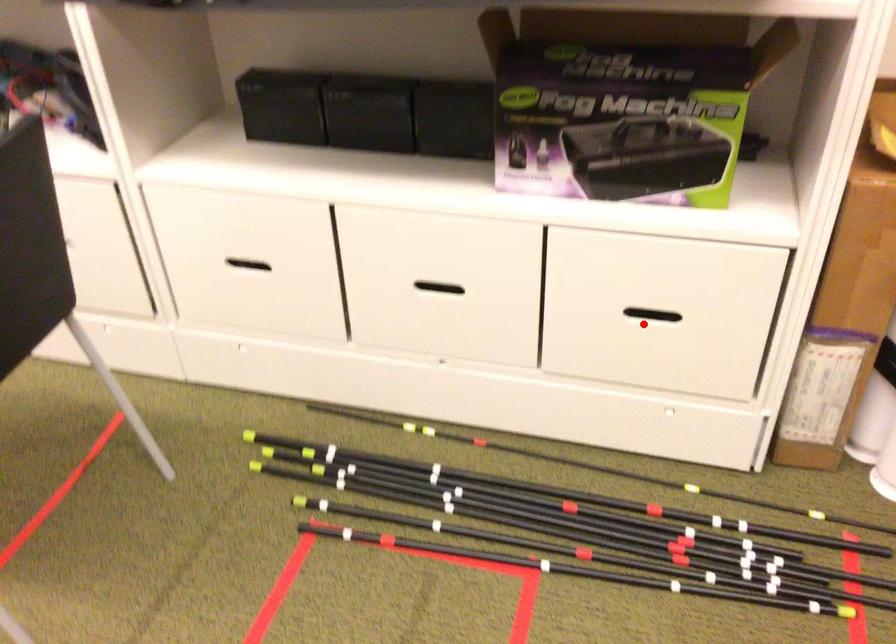
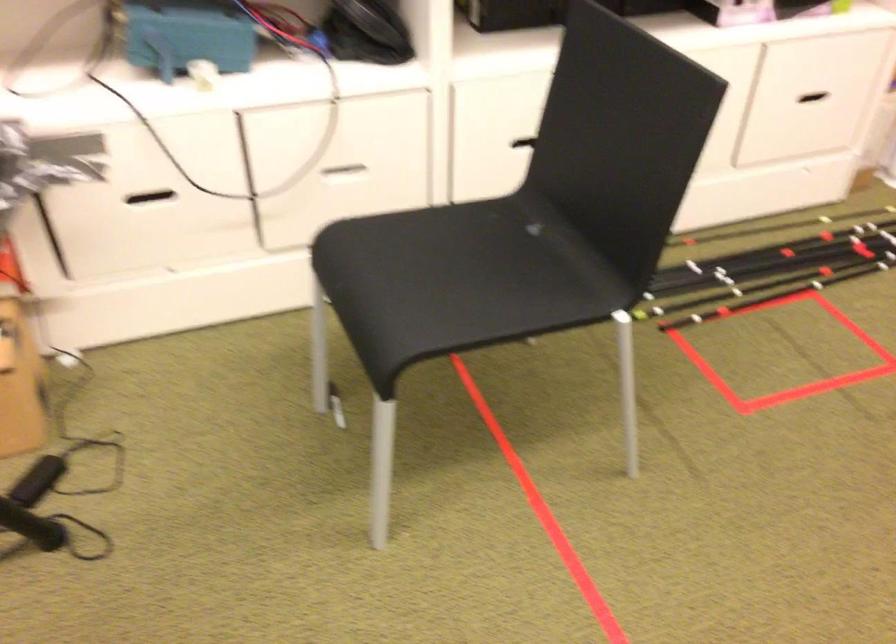
In the second image, find the point that corresponds to the highlighted location in the first image.

(806, 102)